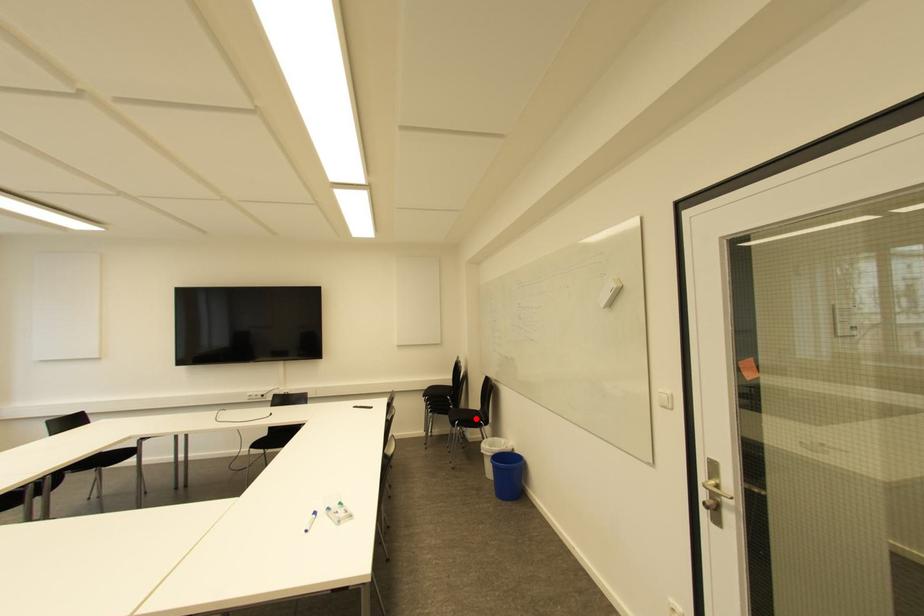
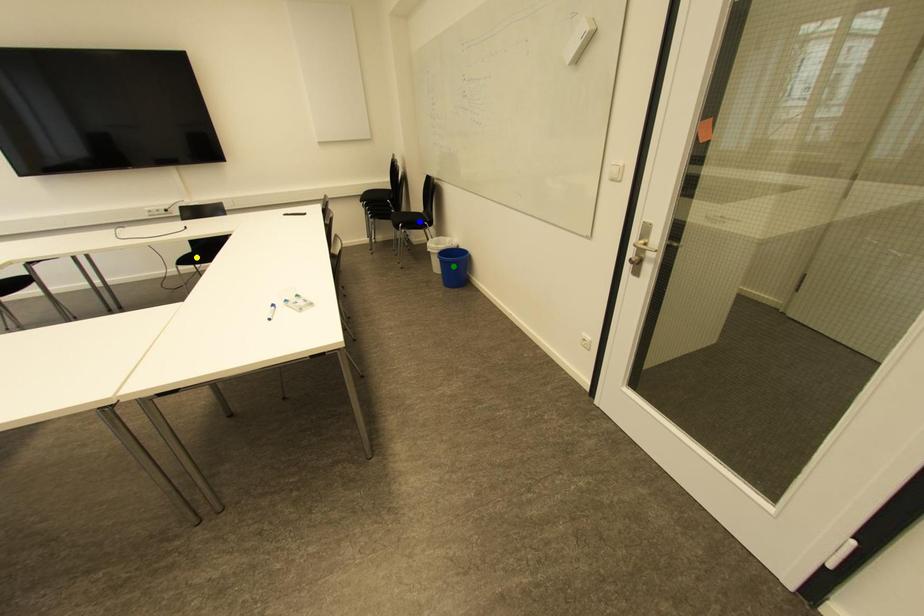
Question: I am providing you with two images of the same scene from different viewpoints. A red point is marked on the first image. You are given multiple points on the second image. Which point in image 2 represents the same 3d spot as the red point in image 1?

Choices:
 (A) yellow point
 (B) blue point
 (C) green point

Answer: (B)